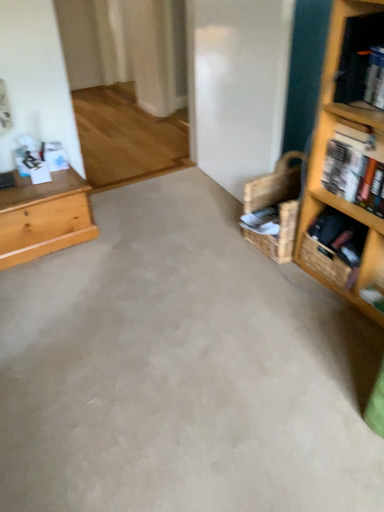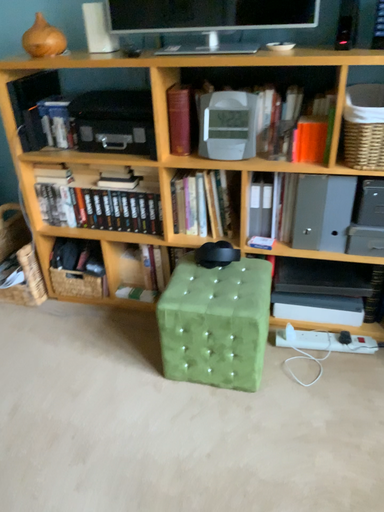
Question: Which way did the camera rotate in the video?

Choices:
 (A) rotated right
 (B) rotated left

Answer: (A)